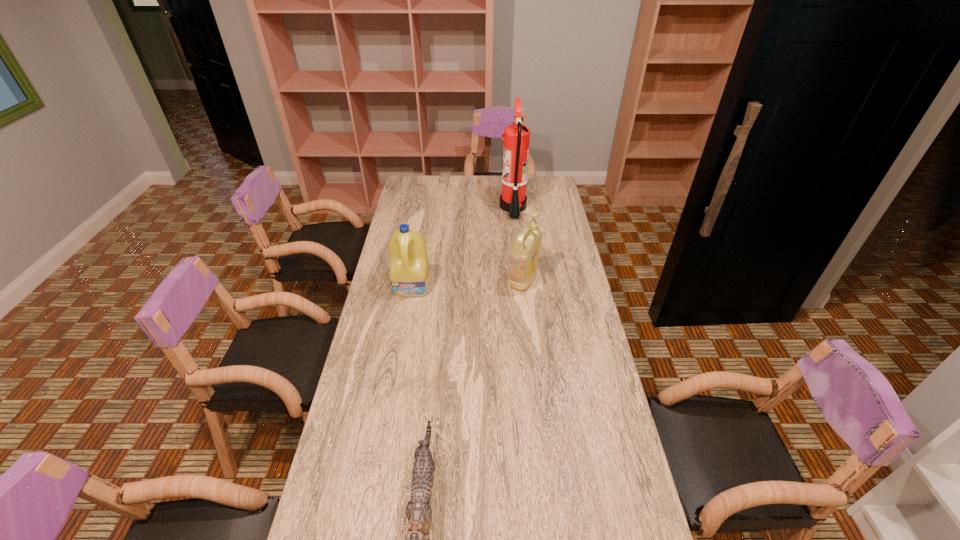
Image resolution: width=960 pixels, height=540 pixels. What are the coordinates of `the tallest object` in the screenshot? It's located at (513, 199).

This screenshot has width=960, height=540. Identify the location of the farthest object. (513, 199).

Identify the location of the right detergent. (525, 251).

Image resolution: width=960 pixels, height=540 pixels. I want to click on the leftmost object, so click(409, 270).

What are the coordinates of `free space located at the nozzle of the tallest object` in the screenshot? It's located at (442, 207).

Locate an element on the screen. Image resolution: width=960 pixels, height=540 pixels. vacant point located at the nozzle of the tallest object is located at coordinates (424, 207).

The image size is (960, 540). Identify the location of free space located at the nozzle of the tallest object. (456, 207).

At what (x,y) coordinates should I click in order to perform the action: click on vacant point located on the back of the right detergent. Please return your answer as a coordinate pair (x, y). Looking at the image, I should click on (521, 259).

This screenshot has width=960, height=540. I want to click on free spot located on the label of the left detergent, so click(399, 364).

At what (x,y) coordinates should I click in order to perform the action: click on object that is at the far edge. Please return your answer as a coordinate pair (x, y). Image resolution: width=960 pixels, height=540 pixels. Looking at the image, I should click on (513, 199).